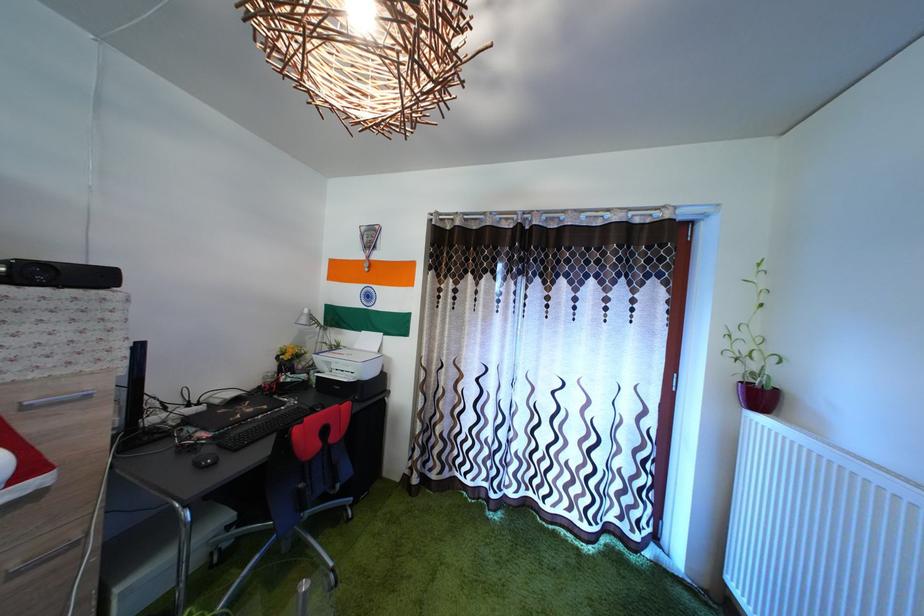
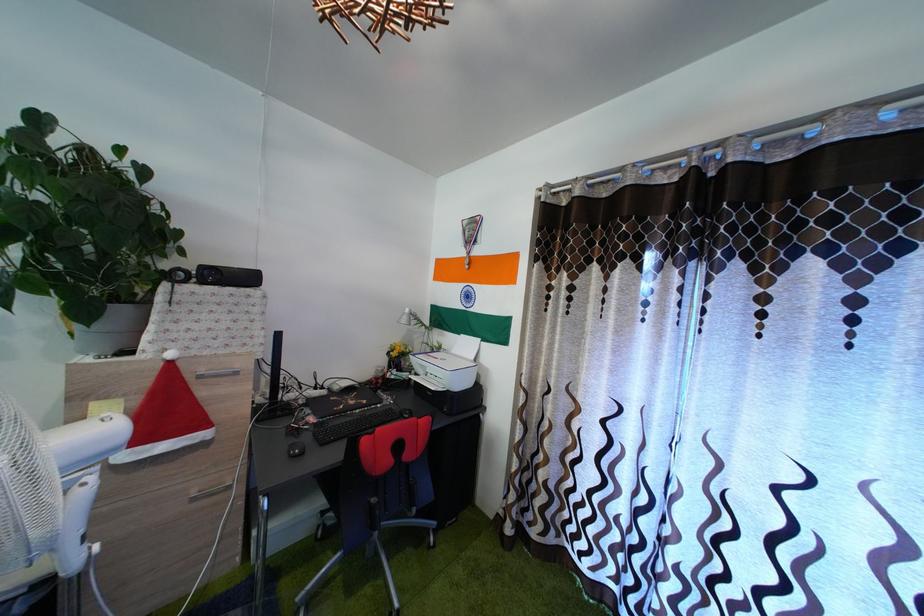
Find the pixel in the second image that matches point 363,354 in the first image.

(462, 359)